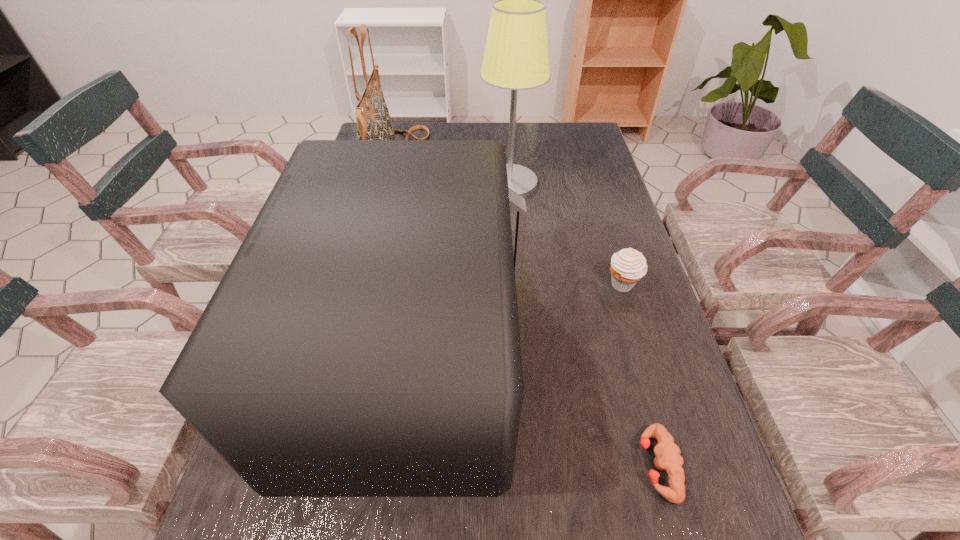
Identify the location of the tallest object. (516, 57).

Locate an element on the screen. handbag is located at coordinates (373, 119).

This screenshot has height=540, width=960. In order to click on microwave oven in this screenshot , I will do `click(364, 341)`.

You are a GUI agent. You are given a task and a screenshot of the screen. Output one action in this format:
    pyautogui.click(x=<x>, y=<y>)
    Task: Click on the muffin
    Image resolution: width=960 pixels, height=540 pixels.
    Given the screenshot: What is the action you would take?
    pyautogui.click(x=628, y=266)

Locate an element on the screen. The image size is (960, 540). the shortest object is located at coordinates (667, 453).

Locate an element on the screen. The image size is (960, 540). vacant space located 0.090m on the back of the tallest object is located at coordinates (507, 153).

Where is `vacant space situated on the front-facing side of the handbag`? This screenshot has height=540, width=960. vacant space situated on the front-facing side of the handbag is located at coordinates (x=507, y=159).

Find the location of a particular element. The image size is (960, 540). vacant position located on the front-facing side of the third tallest object is located at coordinates (597, 352).

Where is `free space located 0.240m on the front of the second shortest object`? This screenshot has width=960, height=540. free space located 0.240m on the front of the second shortest object is located at coordinates (654, 387).

Locate an element on the screen. The image size is (960, 540). vacant space located with the gloves of the puncher facing forward is located at coordinates (504, 465).